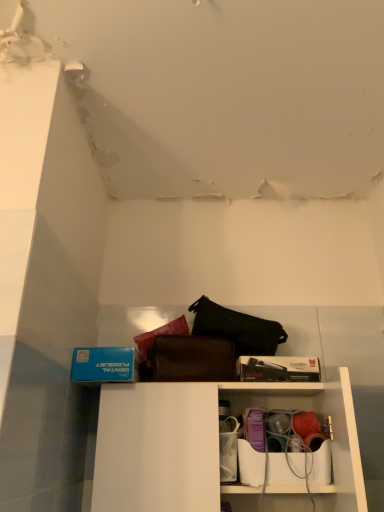
Question: Considering the relative positions of matte plastic container at lower center and white plastic shelf at lower center in the image provided, is matte plastic container at lower center to the left or to the right of white plastic shelf at lower center?

Choices:
 (A) right
 (B) left

Answer: (A)

Question: From a real-world perspective, relative to white plastic shelf at lower center, is matte plastic container at lower center vertically above or below?

Choices:
 (A) below
 (B) above

Answer: (A)

Question: Do you think matte plastic container at lower center is within white plastic shelf at lower center, or outside of it?

Choices:
 (A) inside
 (B) outside

Answer: (A)

Question: Considering the positions of white plastic shelf at lower center and matte plastic container at lower center in the image, is white plastic shelf at lower center wider or thinner than matte plastic container at lower center?

Choices:
 (A) thin
 (B) wide

Answer: (B)

Question: Considering the positions of white plastic shelf at lower center and matte plastic container at lower center in the image, is white plastic shelf at lower center taller or shorter than matte plastic container at lower center?

Choices:
 (A) short
 (B) tall

Answer: (B)

Question: Relative to matte plastic container at lower center, is white plastic shelf at lower center in front or behind?

Choices:
 (A) behind
 (B) front

Answer: (B)

Question: Based on their positions, is white plastic shelf at lower center located to the left or right of matte plastic container at lower center?

Choices:
 (A) right
 (B) left

Answer: (B)